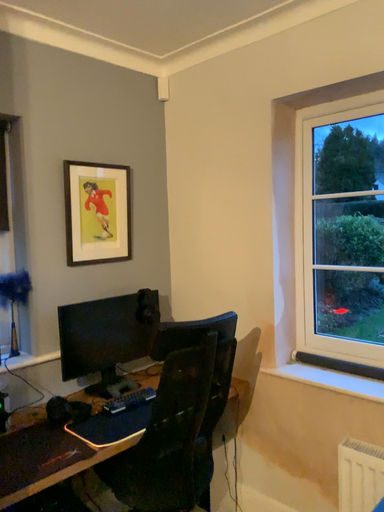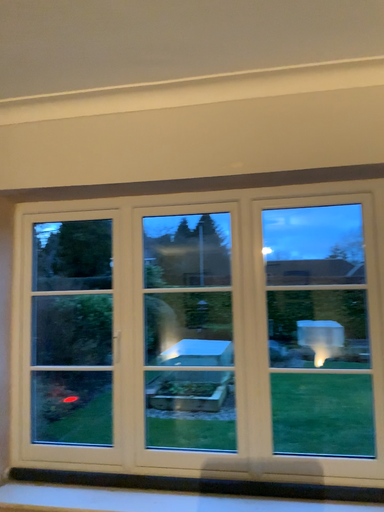
Question: Which way did the camera rotate in the video?

Choices:
 (A) rotated upward
 (B) rotated downward

Answer: (A)